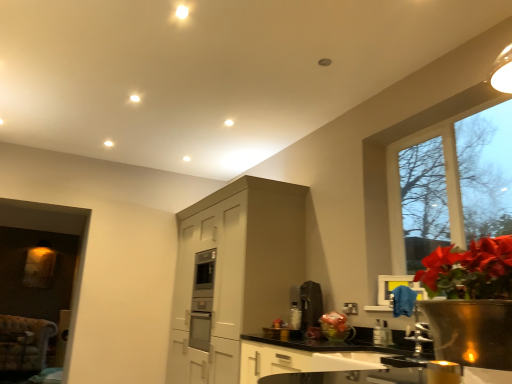
The width and height of the screenshot is (512, 384). What do you see at coordinates (362, 366) in the screenshot?
I see `white glossy sink at lower center` at bounding box center [362, 366].

Locate an element on the screen. This screenshot has height=384, width=512. satin black coffee maker at center is located at coordinates (310, 305).

Locate an element on the screen. This screenshot has height=384, width=512. clear glass window at upper right is located at coordinates (387, 166).

The width and height of the screenshot is (512, 384). What do you see at coordinates (387, 166) in the screenshot? I see `clear glass window at upper right` at bounding box center [387, 166].

At what (x,y) coordinates should I click in order to perform the action: click on black granite countertop at center. Please return your answer as a coordinate pair (x, y). The height and width of the screenshot is (384, 512). Looking at the image, I should click on (307, 356).

Describe the element at coordinates (233, 274) in the screenshot. I see `matte gray cabinet at center` at that location.

This screenshot has width=512, height=384. I want to click on white glossy sink at lower center, so click(362, 366).

Looking at this image, who is more distant, satin nickel faucet at lower right or white glossy sink at lower center?

satin nickel faucet at lower right is behind.

Considering the sizes of objects satin nickel faucet at lower right and white glossy sink at lower center in the image provided, who is taller, satin nickel faucet at lower right or white glossy sink at lower center?

With more height is satin nickel faucet at lower right.

From the image's perspective, is satin nickel faucet at lower right under white glossy sink at lower center?

Incorrect, from the image's perspective, satin nickel faucet at lower right is higher than white glossy sink at lower center.

Looking at this image, is white glossy sink at lower center surrounded by satin nickel faucet at lower right?

Actually, white glossy sink at lower center is outside satin nickel faucet at lower right.

Does matte gray cabinet at center turn towards satin black coffee maker at center?

No, matte gray cabinet at center is not turned towards satin black coffee maker at center.

Considering the sizes of objects matte gray cabinet at center and satin black coffee maker at center in the image provided, who is thinner, matte gray cabinet at center or satin black coffee maker at center?

satin black coffee maker at center.

Is point (201, 273) farther from viewer compared to point (300, 292)?

Yes, point (201, 273) is behind point (300, 292).

I want to click on cabinetry that is above the satin black coffee maker at center (from a real-world perspective), so click(x=233, y=274).

Does satin black coffee maker at center have a larger size compared to satin nickel faucet at lower right?

No, satin black coffee maker at center is not bigger than satin nickel faucet at lower right.

Would you say satin black coffee maker at center is outside satin nickel faucet at lower right?

Indeed, satin black coffee maker at center is completely outside satin nickel faucet at lower right.

From the image's perspective, is satin black coffee maker at center located above or below satin nickel faucet at lower right?

satin black coffee maker at center is situated lower than satin nickel faucet at lower right in the image.

Can you confirm if satin black coffee maker at center is thinner than satin nickel faucet at lower right?

Correct, the width of satin black coffee maker at center is less than that of satin nickel faucet at lower right.

Considering the sizes of satin nickel faucet at lower right and matte gray cabinet at center in the image, is satin nickel faucet at lower right wider or thinner than matte gray cabinet at center?

satin nickel faucet at lower right is thinner than matte gray cabinet at center.

In the scene shown: Is satin nickel faucet at lower right situated inside matte gray cabinet at center or outside?

satin nickel faucet at lower right is outside matte gray cabinet at center.

Relative to matte gray cabinet at center, is satin nickel faucet at lower right in front or behind?

Clearly, satin nickel faucet at lower right is in front of matte gray cabinet at center.

Which is less distant, [326,323] or [306,315]?

The point [326,323] is closer to the camera.

Is translucent plastic vase at lower center turned away from satin black coffee maker at center?

translucent plastic vase at lower center is not turned away from satin black coffee maker at center.

In terms of size, does translucent plastic vase at lower center appear bigger or smaller than satin black coffee maker at center?

Clearly, translucent plastic vase at lower center is smaller in size than satin black coffee maker at center.

Which of these two, translucent plastic vase at lower center or satin black coffee maker at center, is wider?

satin black coffee maker at center is wider.

You are a GUI agent. You are given a task and a screenshot of the screen. Output one action in this format:
    pyautogui.click(x=<x>, y=<y>)
    Task: Click on the sink beneath the satin nickel faucet at lower right (from a real-world perspective)
    
    Given the screenshot: What is the action you would take?
    pyautogui.click(x=362, y=366)

Is white glossy sink at lower center oriented away from satin nickel faucet at lower right?

No, white glossy sink at lower center's orientation is not away from satin nickel faucet at lower right.

Can you confirm if white glossy sink at lower center is wider than satin nickel faucet at lower right?

Correct, the width of white glossy sink at lower center exceeds that of satin nickel faucet at lower right.

How far apart are satin nickel faucet at lower right and clear glass window at upper right?

satin nickel faucet at lower right and clear glass window at upper right are 31.15 inches apart.

From the image's perspective, between satin nickel faucet at lower right and clear glass window at upper right, who is located below?

satin nickel faucet at lower right appears lower in the image.

Who is smaller, satin nickel faucet at lower right or clear glass window at upper right?

satin nickel faucet at lower right.

From a real-world perspective, which is physically above, satin nickel faucet at lower right or clear glass window at upper right?

clear glass window at upper right.

Image resolution: width=512 pixels, height=384 pixels. What are the coordinates of `faucet on the right side of white glossy sink at lower center` in the screenshot? It's located at (410, 315).

The image size is (512, 384). Find the location of `appliance behind the matte gray cabinet at center`. appliance behind the matte gray cabinet at center is located at coordinates (310, 305).

From the image, which object appears to be nearer to satin nickel faucet at lower right, clear glass window at upper right or black granite countertop at center?

black granite countertop at center.

Based on their spatial positions, is black granite countertop at center or translucent plastic vase at lower center further from satin black coffee maker at center?

black granite countertop at center is positioned further to the anchor satin black coffee maker at center.

Which object lies nearer to the anchor point black granite countertop at center, matte gray cabinet at center or translucent plastic vase at lower center?

Based on the image, translucent plastic vase at lower center appears to be nearer to black granite countertop at center.

Considering their positions, is translucent plastic vase at lower center positioned closer to satin black coffee maker at center than white glossy sink at lower center?

translucent plastic vase at lower center is closer to satin black coffee maker at center.

Based on the photo, when comparing their distances from satin black coffee maker at center, does satin nickel faucet at lower right or white glossy sink at lower center seem closer?

white glossy sink at lower center is positioned closer to the anchor satin black coffee maker at center.

Considering their positions, is satin nickel faucet at lower right positioned further to clear glass window at upper right than satin black coffee maker at center?

Based on the image, satin black coffee maker at center appears to be further to clear glass window at upper right.

Based on the photo, based on their spatial positions, is satin black coffee maker at center or black granite countertop at center further from translucent plastic vase at lower center?

satin black coffee maker at center is positioned further to the anchor translucent plastic vase at lower center.

Which object lies nearer to the anchor point satin black coffee maker at center, black granite countertop at center or satin nickel faucet at lower right?

black granite countertop at center.

Locate an element on the screen. faucet between clear glass window at upper right and satin black coffee maker at center from front to back is located at coordinates (410, 315).

Find the location of a particular element. This screenshot has height=384, width=512. window between black granite countertop at center and translucent plastic vase at lower center from front to back is located at coordinates (387, 166).

You are a GUI agent. You are given a task and a screenshot of the screen. Output one action in this format:
    pyautogui.click(x=<x>, y=<y>)
    Task: Click on the flower located between black granite countertop at center and satin black coffee maker at center in the depth direction
    
    Given the screenshot: What is the action you would take?
    pyautogui.click(x=334, y=324)

Where is `appliance located between matte gray cabinet at center and translucent plastic vase at lower center in the left-right direction`? This screenshot has height=384, width=512. appliance located between matte gray cabinet at center and translucent plastic vase at lower center in the left-right direction is located at coordinates (310, 305).